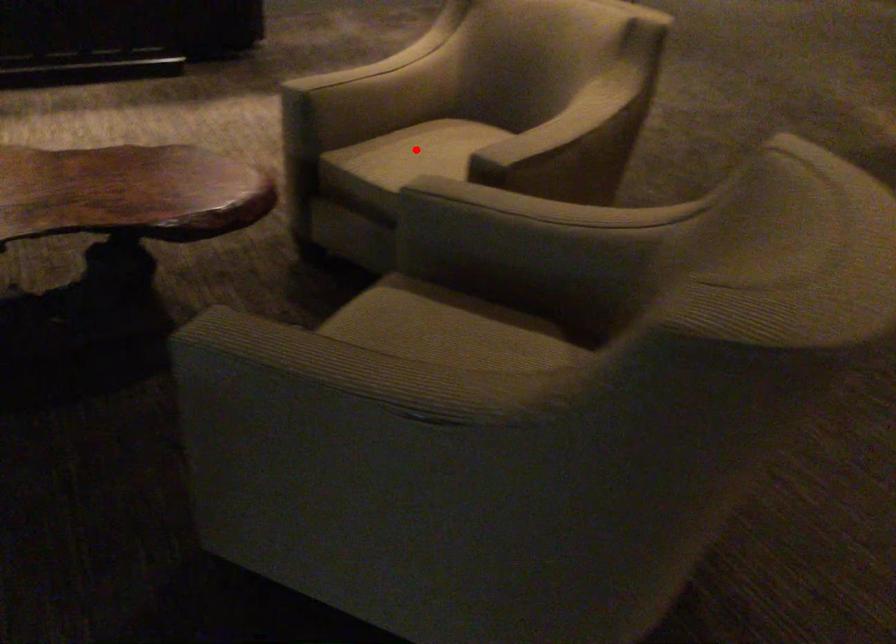
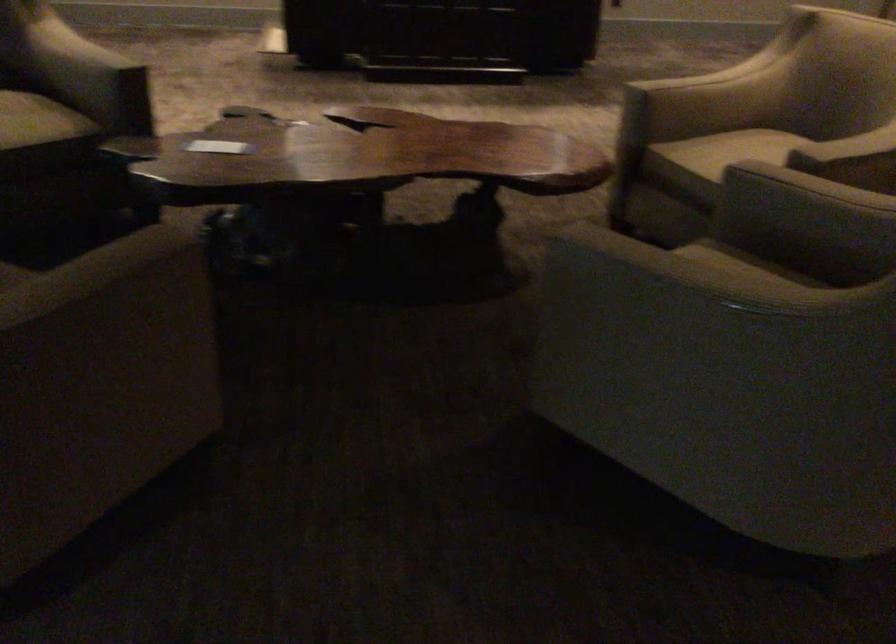
Question: I am providing you with two images of the same scene from different viewpoints. In image1, a red point is highlighted. Considering the same 3D point in image2, which of the following is correct?

Choices:
 (A) It is closer
 (B) It is farther

Answer: (B)